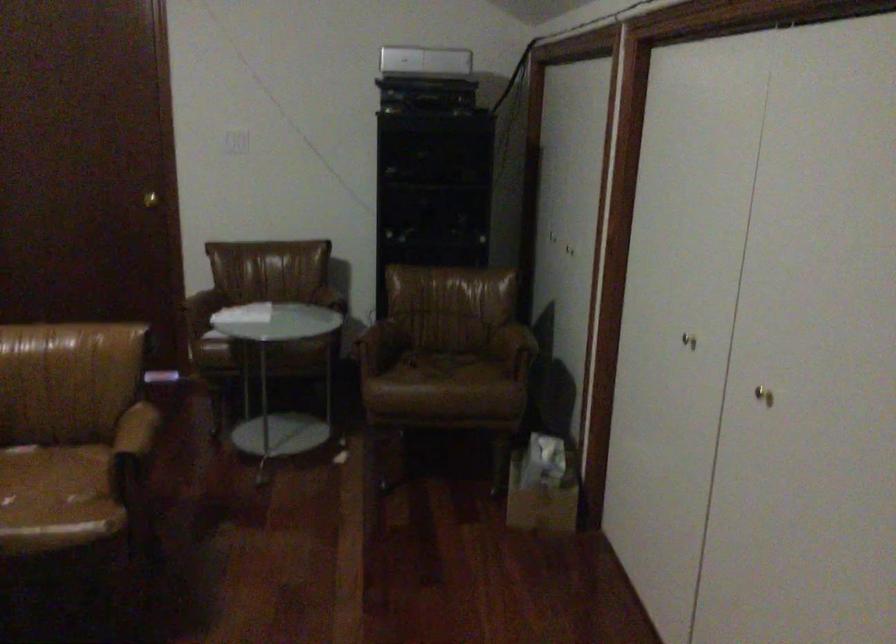
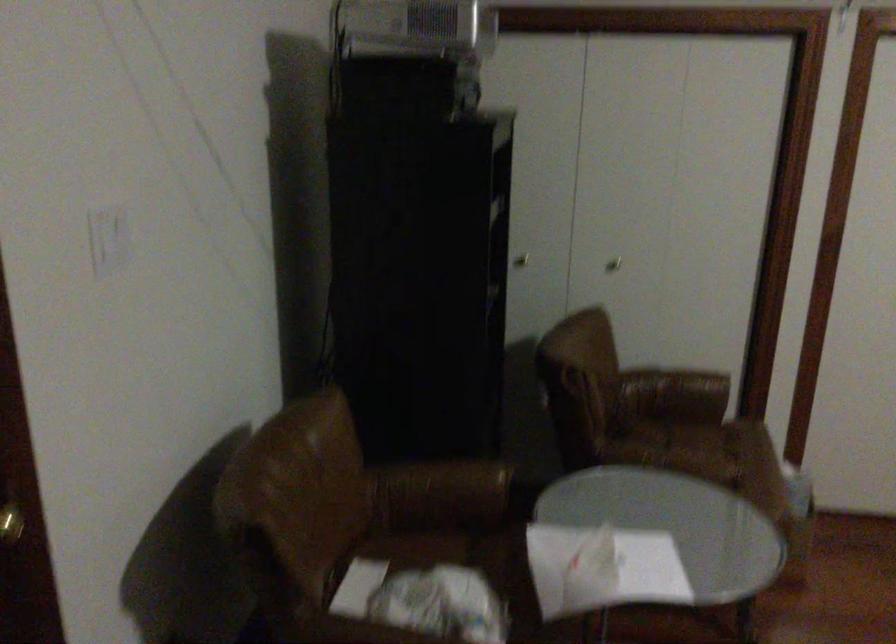
In the second image, find the point that corresponds to (x=479, y=383) in the first image.

(718, 442)